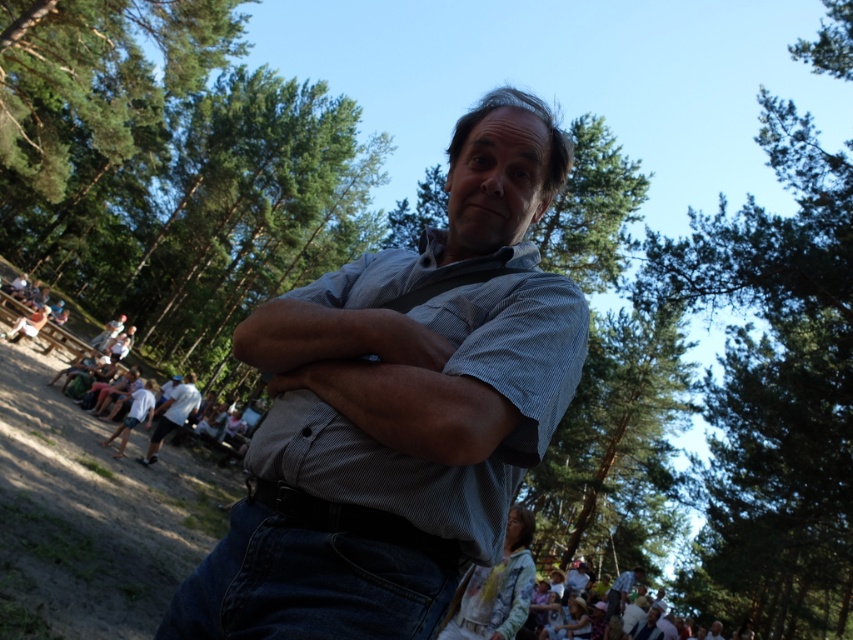
Question: Among these points, which one is nearest to the camera?

Choices:
 (A) (625, 576)
 (B) (485, 116)

Answer: (B)

Question: Can you confirm if striped cotton shirt at center is positioned to the right of white cotton shirt at lower left?

Choices:
 (A) yes
 (B) no

Answer: (A)

Question: Which object is the farthest from the white cotton shirt at lower left?

Choices:
 (A) striped cotton shirt at center
 (B) blue striped shirt at center

Answer: (A)

Question: Does striped cotton shirt at center appear on the left side of white cotton shirt at lower left?

Choices:
 (A) yes
 (B) no

Answer: (B)

Question: Which of the following is the closest to the observer?

Choices:
 (A) (625, 577)
 (B) (254, 545)

Answer: (B)

Question: Does striped cotton shirt at center have a greater width compared to white cotton shirt at lower left?

Choices:
 (A) yes
 (B) no

Answer: (A)